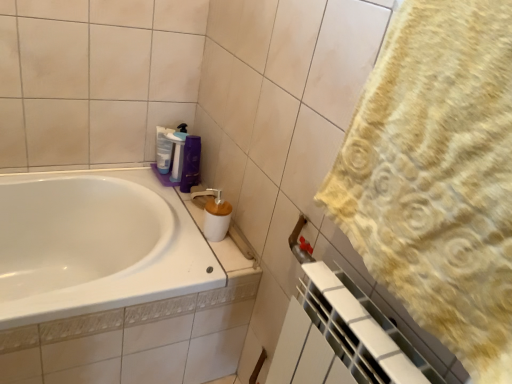
Question: Considering the relative positions of purple plastic bottle at upper center, which is counted as the 1th cleaning product, starting from the right, and yellow textured towel at right in the image provided, is purple plastic bottle at upper center, which is counted as the 1th cleaning product, starting from the right, to the left or to the right of yellow textured towel at right?

Choices:
 (A) right
 (B) left

Answer: (B)

Question: In terms of width, does purple plastic bottle at upper center, which ranks as the second cleaning product in left-to-right order, look wider or thinner when compared to yellow textured towel at right?

Choices:
 (A) wide
 (B) thin

Answer: (B)

Question: Which object is the farthest from the brown matte soap dispenser at center?

Choices:
 (A) purple glossy shampoo at upper center
 (B) purple plastic bottle at upper center, which is counted as the 1th cleaning product, starting from the right
 (C) yellow textured towel at right
 (D) translucent plastic bottle at upper center, acting as the first cleaning product starting from the left

Answer: (C)

Question: Based on their relative distances, which object is farther from the yellow textured towel at right?

Choices:
 (A) translucent plastic bottle at upper center, the second cleaning product in the right-to-left sequence
 (B) purple glossy shampoo at upper center
 (C) purple plastic bottle at upper center, which is counted as the 1th cleaning product, starting from the right
 (D) brown matte soap dispenser at center

Answer: (A)